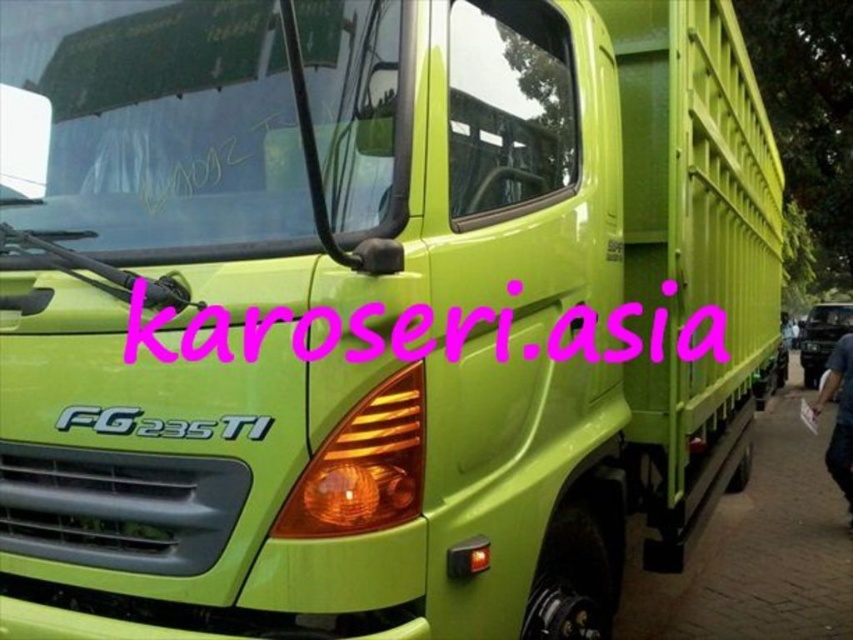
Question: Is pink text at center to the left of green matte license plate at center from the viewer's perspective?

Choices:
 (A) yes
 (B) no

Answer: (A)

Question: Does pink text at center have a greater width compared to green matte license plate at center?

Choices:
 (A) yes
 (B) no

Answer: (A)

Question: Among these objects, which one is nearest to the camera?

Choices:
 (A) green matte license plate at center
 (B) pink text at center

Answer: (B)

Question: Is pink text at center smaller than green matte license plate at center?

Choices:
 (A) no
 (B) yes

Answer: (A)